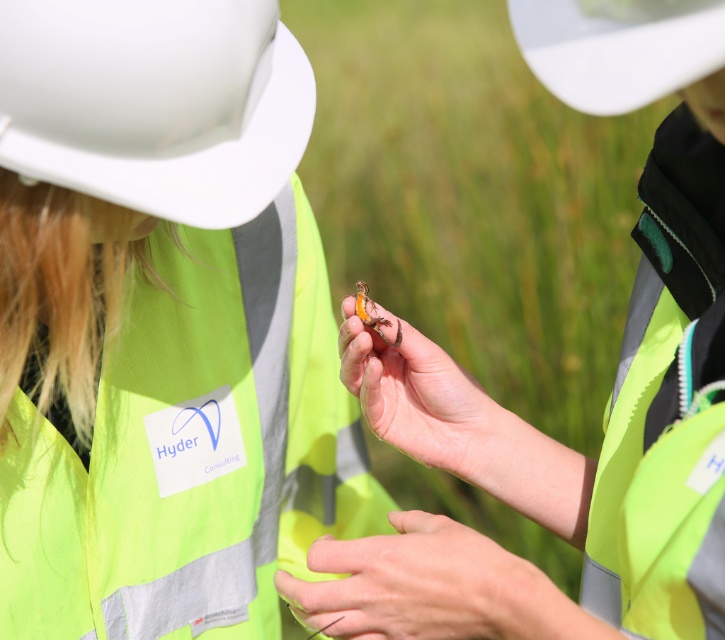
You are a safety inspector at Hyder Consulting. You observe two objects at the center of your field of view while inspecting the site. What is the relationship between the smooth orange skin at center and the translucent orange insect at center in terms of their vertical positions?

The smooth orange skin at center is below the translucent orange insect at center.

From the picture: You are a safety inspector at Hyder Consulting and need to mark two points in the image for a safety report. The first point is at coordinates point (x=465, y=588) and the second at point (x=183, y=20). According to the image, which point is closer to the observer?

Point (x=465, y=588) is closer to the observer than point (x=183, y=20).